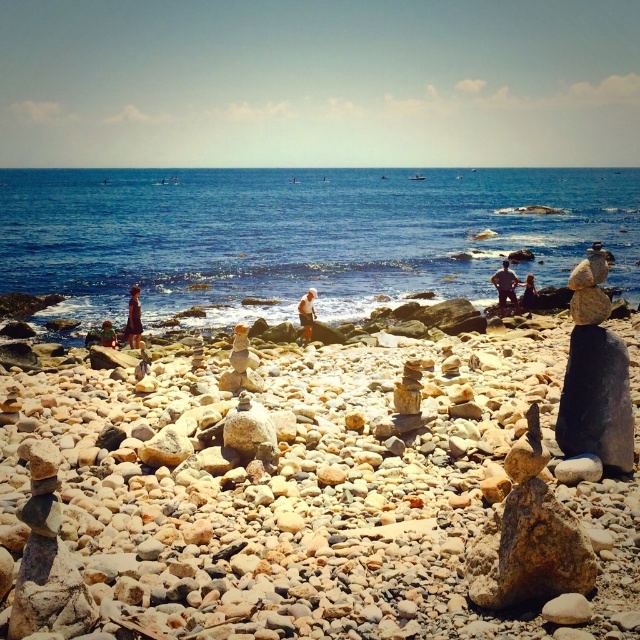
Question: Does smooth sand at center have a lesser width compared to dark brown leather pants at center?

Choices:
 (A) no
 (B) yes

Answer: (A)

Question: Which point is closer to the camera?

Choices:
 (A) pos(140,333)
 (B) pos(372,440)
 (C) pos(234,358)
 (D) pos(301,305)

Answer: (B)

Question: Which point is closer to the camera?

Choices:
 (A) smooth stone figure at center
 (B) brown fabric dress at lower left
 (C) light brown hair at center

Answer: (B)

Question: Can you confirm if dark brown leather pants at center is positioned to the left of light brown hair at center?

Choices:
 (A) no
 (B) yes

Answer: (A)

Question: Observing the image, what is the correct spatial positioning of smooth pebbles at center in reference to light brown wooden stick at center?

Choices:
 (A) below
 (B) above

Answer: (A)

Question: Which point appears farthest from the camera in this image?

Choices:
 (A) (266, 212)
 (B) (131, 323)

Answer: (A)